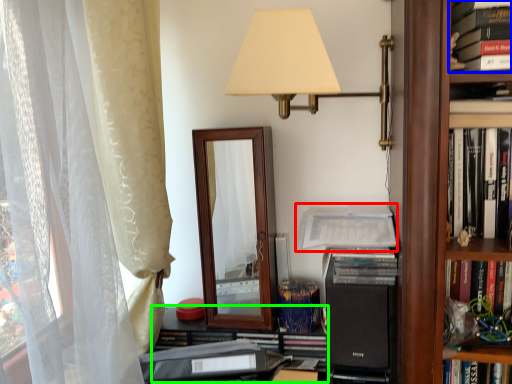
Question: Which object is the farthest from paperback book (highlighted by a red box)? Choose among these: book (highlighted by a blue box) or shelf (highlighted by a green box).

Choices:
 (A) book
 (B) shelf

Answer: (A)